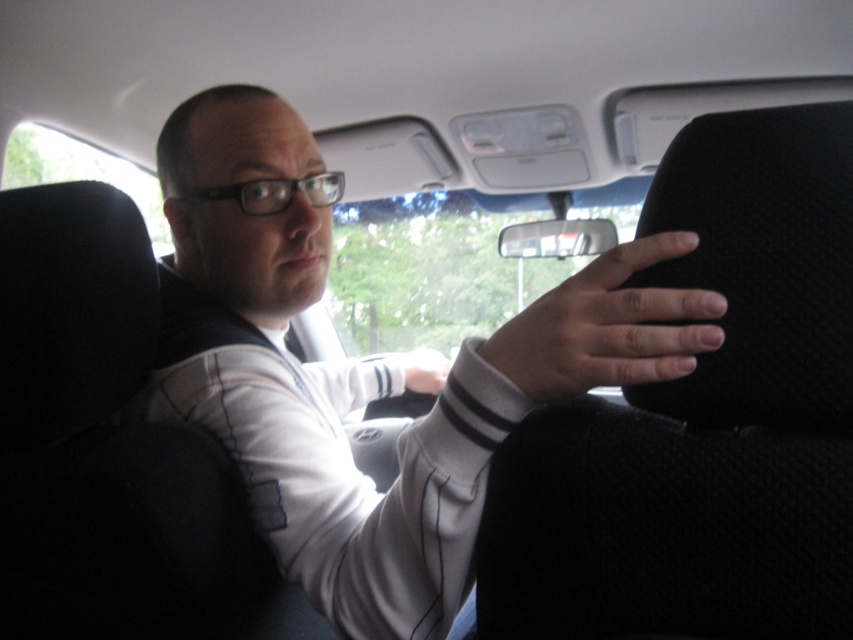
You are a passenger in the car and want to know which hand is closer to the sunroof. Based on the smooth skin hand at right and the matte white hand at center, which one is closer?

The smooth skin hand at right is much taller than the matte white hand at center, so the smooth skin hand at right is closer to the sunroof.

You are sitting in the backseat of the car and want to touch the point at coordinates (704,420). Which object in the car would your hand first contact?

The point at coordinates (704,420) is located on the black fabric seat at center, so your hand would first contact the black fabric seat at center.